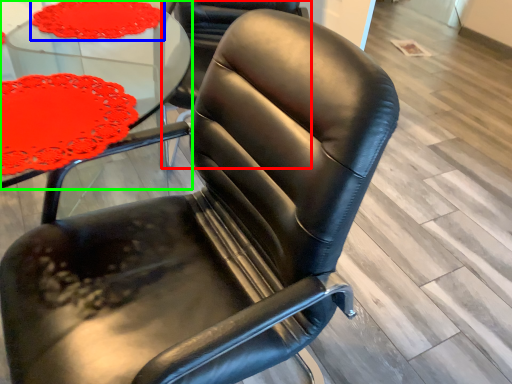
Question: Considering the real-world distances, which object is closest to chair (highlighted by a red box)? tablecloth (highlighted by a blue box) or table (highlighted by a green box).

Choices:
 (A) tablecloth
 (B) table

Answer: (B)